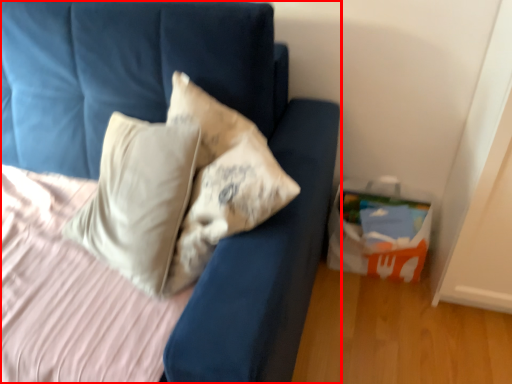
Question: From the image's perspective, what is the correct spatial relationship of furniture (annotated by the red box) in relation to package?

Choices:
 (A) above
 (B) below

Answer: (A)